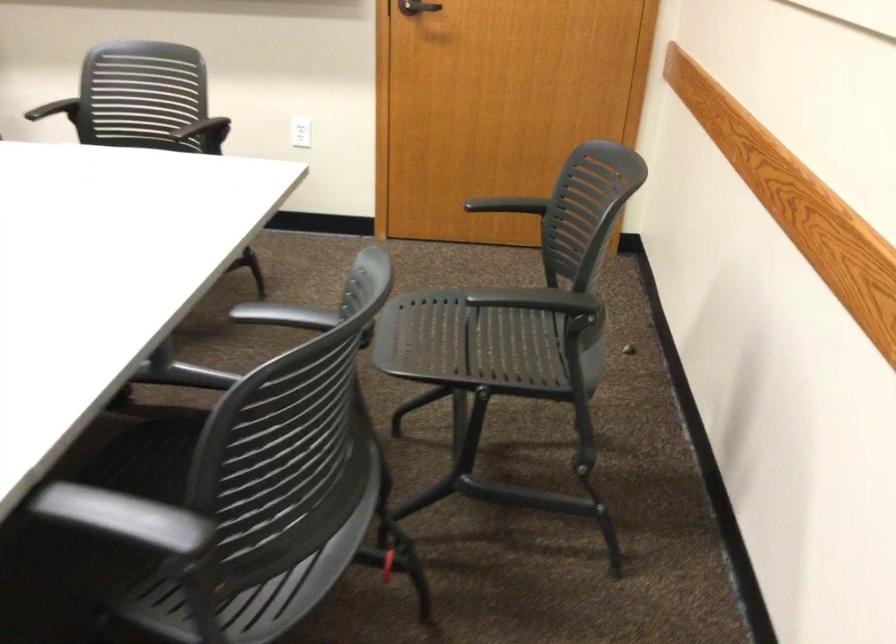
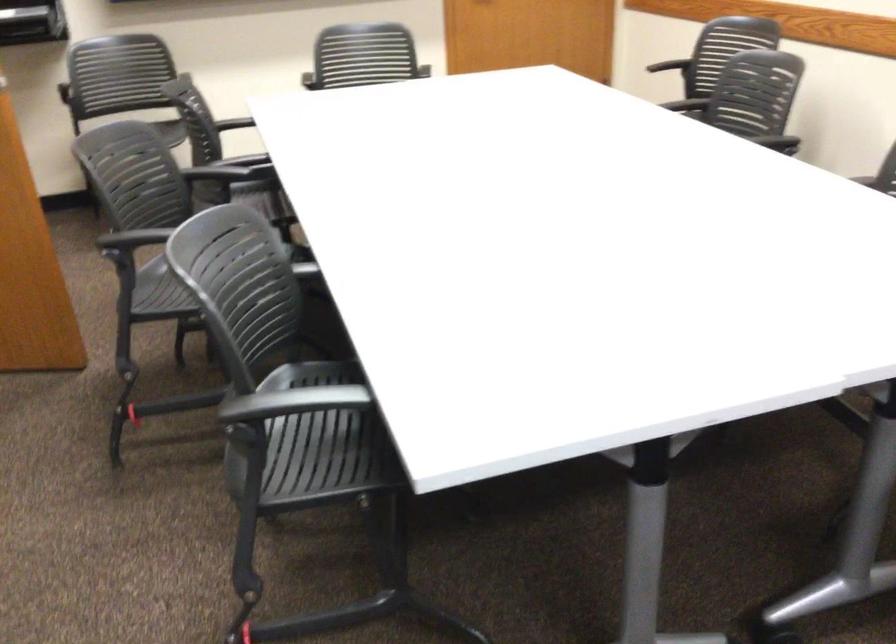
In a continuous first-person perspective shot, in which direction is the camera moving?

The cameraman walked toward left, backward.